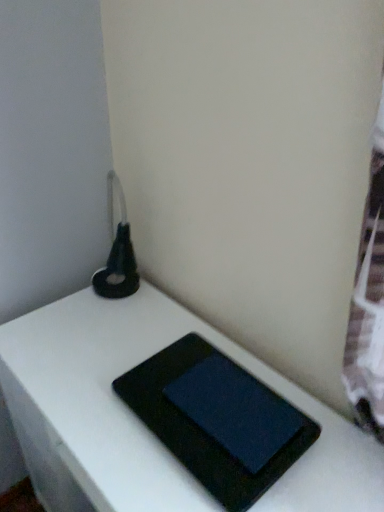
The image size is (384, 512). I want to click on vacant area situated to the left side of black matte tablet at center, the 2th tablet computer in the top-to-bottom sequence, so click(94, 399).